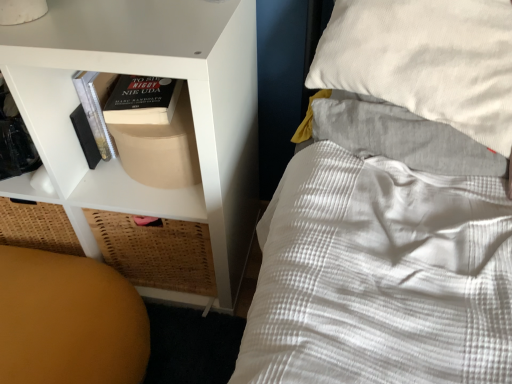
What do you see at coordinates (69, 321) in the screenshot?
I see `orange matte ball at lower left` at bounding box center [69, 321].

Measure the distance between orange matte ball at lower left and camera.

The depth of orange matte ball at lower left is 81.90 centimeters.

You are a GUI agent. You are given a task and a screenshot of the screen. Output one action in this format:
    pyautogui.click(x=<x>, y=<y>)
    Task: Click on the orange matte ball at lower left
    The image size is (512, 384).
    Given the screenshot: What is the action you would take?
    click(69, 321)

The height and width of the screenshot is (384, 512). What do you see at coordinates (153, 75) in the screenshot?
I see `white matte shelf at left` at bounding box center [153, 75].

This screenshot has width=512, height=384. Identify the location of white matte shelf at left. (153, 75).

Locate an element on the screen. The height and width of the screenshot is (384, 512). orange matte ball at lower left is located at coordinates (69, 321).

Which object is positioned more to the left, white matte shelf at left or orange matte ball at lower left?

orange matte ball at lower left is more to the left.

Considering the relative positions of white matte shelf at left and orange matte ball at lower left in the image provided, is white matte shelf at left behind orange matte ball at lower left?

No, the depth of white matte shelf at left is less than that of orange matte ball at lower left.

Does point (178, 212) appear closer or farther from the camera than point (113, 330)?

Point (178, 212) is farther from the camera than point (113, 330).

Consider the image. From the image's perspective, which one is positioned higher, white matte shelf at left or orange matte ball at lower left?

white matte shelf at left.

From a real-world perspective, is white matte shelf at left below orange matte ball at lower left?

No, from a real-world perspective, white matte shelf at left is not below orange matte ball at lower left.

Which of these two, white matte shelf at left or orange matte ball at lower left, is wider?

orange matte ball at lower left.

Does white matte shelf at left have a greater height compared to orange matte ball at lower left?

Yes, white matte shelf at left is taller than orange matte ball at lower left.

Is white matte shelf at left bigger than orange matte ball at lower left?

Yes.

Looking at this image, is orange matte ball at lower left completely or partially inside white matte shelf at left?

No, orange matte ball at lower left is not a part of white matte shelf at left.

Are white matte shelf at left and orange matte ball at lower left far apart?

No.

Is white matte shelf at left oriented away from orange matte ball at lower left?

No, white matte shelf at left is not facing the opposite direction of orange matte ball at lower left.

How different are the orientations of white matte shelf at left and orange matte ball at lower left in degrees?

The angle between the facing direction of white matte shelf at left and the facing direction of orange matte ball at lower left is 89.9 degrees.

Find the location of a particular element. This screenshot has height=384, width=512. shelf in front of the orange matte ball at lower left is located at coordinates (153, 75).

Which is more to the left, orange matte ball at lower left or white matte shelf at left?

From the viewer's perspective, orange matte ball at lower left appears more on the left side.

Considering the positions of objects orange matte ball at lower left and white matte shelf at left in the image provided, who is in front, orange matte ball at lower left or white matte shelf at left?

white matte shelf at left is more forward.

Does point (22, 380) lie in front of point (75, 13)?

No, (22, 380) is behind (75, 13).

From the image's perspective, is orange matte ball at lower left above or below white matte shelf at left?

orange matte ball at lower left is situated lower than white matte shelf at left in the image.

From a real-world perspective, which is physically above, orange matte ball at lower left or white matte shelf at left?

white matte shelf at left is physically above.

Can you confirm if orange matte ball at lower left is thinner than white matte shelf at left?

Incorrect, the width of orange matte ball at lower left is not less than that of white matte shelf at left.

Who is taller, orange matte ball at lower left or white matte shelf at left?

white matte shelf at left.

Who is bigger, orange matte ball at lower left or white matte shelf at left?

Bigger between the two is white matte shelf at left.

Do you think orange matte ball at lower left is within white matte shelf at left, or outside of it?

The correct answer is: outside.

Is orange matte ball at lower left next to white matte shelf at left and touching it?

orange matte ball at lower left and white matte shelf at left are clearly separated.

In the scene shown: Could you tell me if orange matte ball at lower left is turned towards white matte shelf at left?

No, orange matte ball at lower left is not aimed at white matte shelf at left.

How different are the orientations of orange matte ball at lower left and white matte shelf at left in degrees?

The angle between the facing direction of orange matte ball at lower left and the facing direction of white matte shelf at left is 89.9 degrees.

I want to click on shelf that is above the orange matte ball at lower left (from the image's perspective), so click(x=153, y=75).

The image size is (512, 384). Identify the location of furniture behind the white matte shelf at left. (69, 321).

Identify the location of shelf in front of the orange matte ball at lower left. (153, 75).